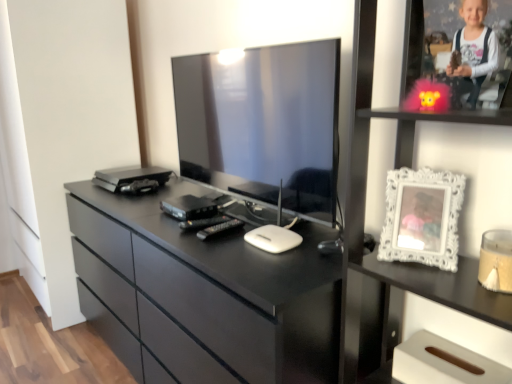
Question: Is white ornate frame at right a part of black glossy chest of drawers at center?

Choices:
 (A) no
 (B) yes

Answer: (A)

Question: From the image's perspective, is black glossy chest of drawers at center below white ornate frame at right?

Choices:
 (A) no
 (B) yes

Answer: (B)

Question: From a real-world perspective, is black glossy chest of drawers at center on top of white ornate frame at right?

Choices:
 (A) yes
 (B) no

Answer: (B)

Question: Considering the relative sizes of black glossy chest of drawers at center and white ornate frame at right in the image provided, is black glossy chest of drawers at center wider than white ornate frame at right?

Choices:
 (A) yes
 (B) no

Answer: (A)

Question: From a real-world perspective, is black glossy chest of drawers at center beneath white ornate frame at right?

Choices:
 (A) yes
 (B) no

Answer: (A)

Question: Can you confirm if black glossy chest of drawers at center is smaller than white ornate frame at right?

Choices:
 (A) yes
 (B) no

Answer: (B)

Question: Is white glossy frame at upper right facing towards white glossy picture frame at upper right?

Choices:
 (A) no
 (B) yes

Answer: (B)

Question: Is white glossy frame at upper right further to camera compared to white glossy picture frame at upper right?

Choices:
 (A) yes
 (B) no

Answer: (A)

Question: From a real-world perspective, is white glossy frame at upper right positioned under white glossy picture frame at upper right based on gravity?

Choices:
 (A) yes
 (B) no

Answer: (B)

Question: Does white glossy frame at upper right have a larger size compared to white glossy picture frame at upper right?

Choices:
 (A) no
 (B) yes

Answer: (A)

Question: From the image's perspective, does white glossy frame at upper right appear lower than white glossy picture frame at upper right?

Choices:
 (A) yes
 (B) no

Answer: (B)

Question: Does white glossy frame at upper right have a greater height compared to white glossy picture frame at upper right?

Choices:
 (A) no
 (B) yes

Answer: (A)

Question: Is there a large distance between white glossy picture frame at upper right and satin black device at center?

Choices:
 (A) no
 (B) yes

Answer: (A)